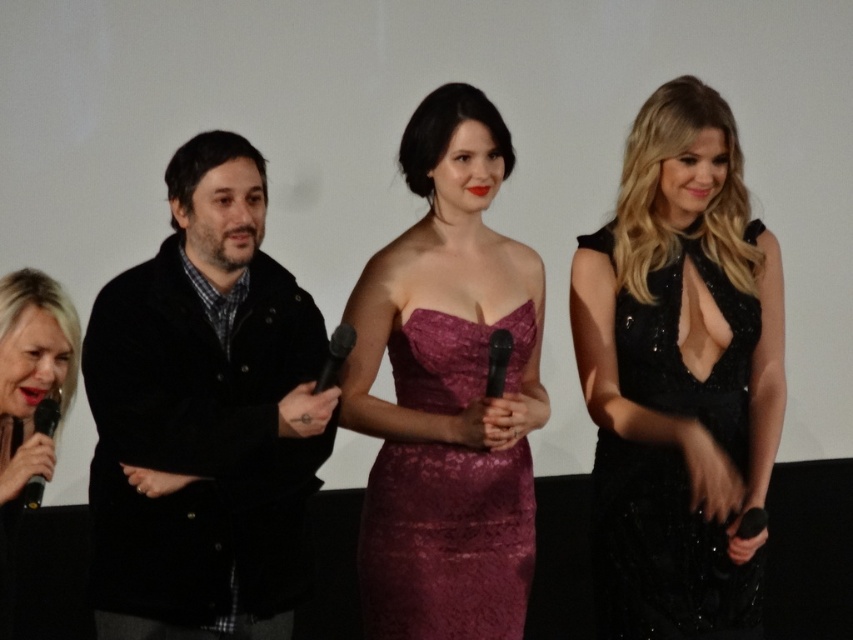
You are a photographer at the event. You need to take a portrait of both the black woolen coat at left and the burgundy lace dress at center. Which one should you focus on first to ensure both are in sharp focus?

The black woolen coat at left is closer to the viewer than the burgundy lace dress at center, so you should focus on the black woolen coat at left first. This ensures that both will be in focus as the depth of field will cover the distance between them.

You are organizing a photo shoot and need to ensure that all items in the scene are visible in the final image. Given that the camera has a limited field of view, which object between the black woolen coat at left and the black metallic microphone at center requires more space to capture in full detail?

The black woolen coat at left requires more space to capture in full detail because its width is larger than that of the black metallic microphone at center.